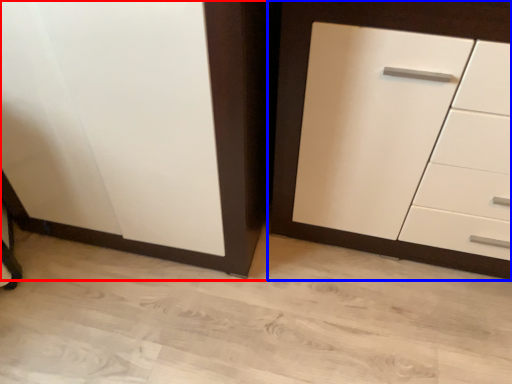
Question: Which point is further to the camera, cupboard (highlighted by a red box) or chest of drawers (highlighted by a blue box)?

Choices:
 (A) cupboard
 (B) chest of drawers

Answer: (A)